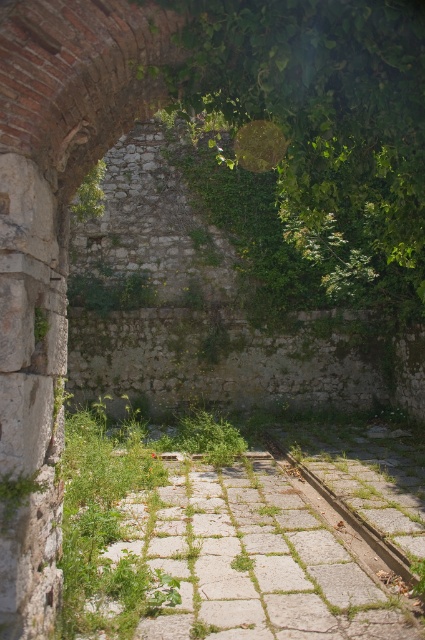
Is gray stone path at center behind gray concrete train track at center?

No, gray stone path at center is in front of gray concrete train track at center.

Is point (223, 500) in front of point (314, 476)?

Yes.

What do you see at coordinates (255, 560) in the screenshot? I see `gray stone path at center` at bounding box center [255, 560].

Identify the location of gray stone path at center. The image size is (425, 640). (255, 560).